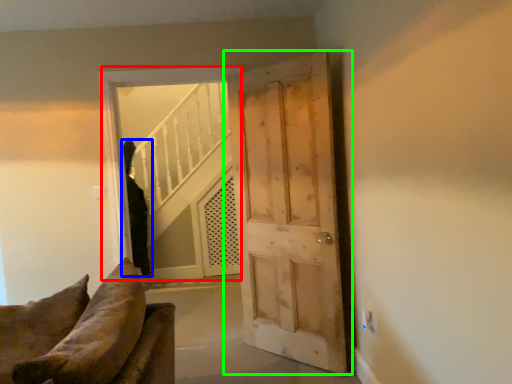
Question: Based on their relative distances, which object is nearer to window (highlighted by a red box)? Choose from person (highlighted by a blue box) and door (highlighted by a green box).

Choices:
 (A) person
 (B) door

Answer: (B)